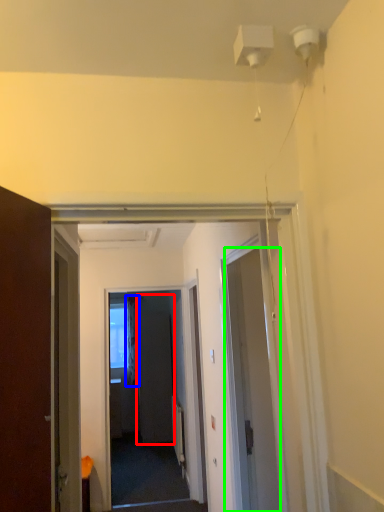
Question: Based on their relative distances, which object is nearer to screen door (highlighted by a red box)? Choose from curtain (highlighted by a blue box) and door (highlighted by a green box).

Choices:
 (A) curtain
 (B) door

Answer: (A)